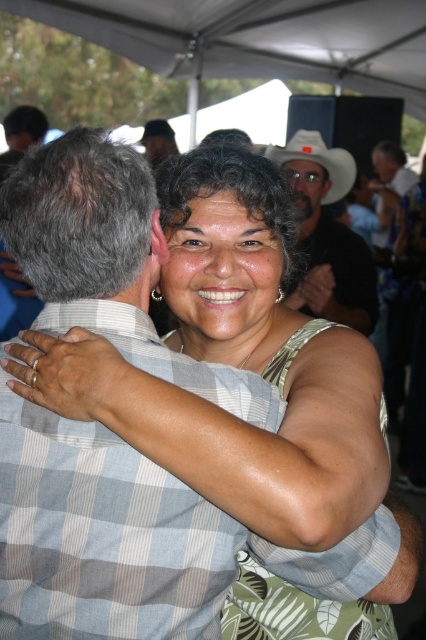
You are a photographer at the event and want to ensure both the matte black cowboy hat at upper center and the white matte cowboy hat at upper center are clearly visible in your photo. Given that your camera has a minimum focus distance of 10 inches, will you need to adjust your position to capture both hats without blurring?

The distance between the matte black cowboy hat at upper center and the white matte cowboy hat at upper center is 9.34 inches. Since this is less than the camera minimum focus distance of 10 inches, you will need to move further away to ensure both hats are in focus.